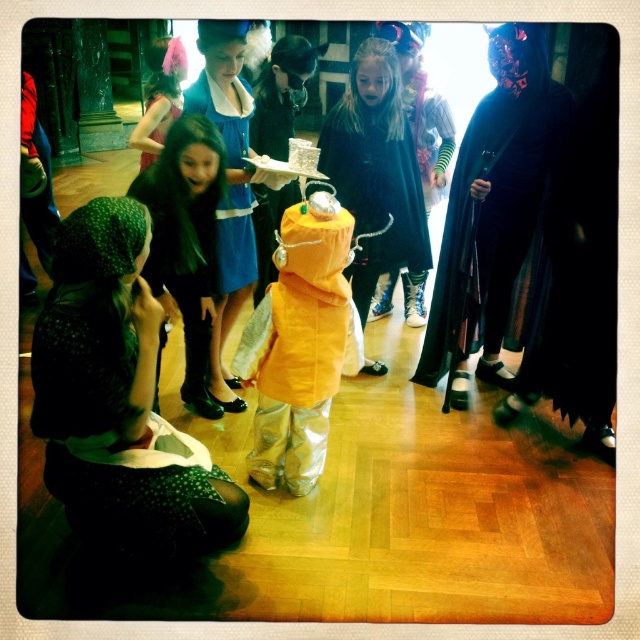
Between orange metallic suit at center and matte pink dress at upper left, which one has less height?

matte pink dress at upper left

What do you see at coordinates (298, 344) in the screenshot? I see `orange metallic suit at center` at bounding box center [298, 344].

Where is `orange metallic suit at center`? orange metallic suit at center is located at coordinates (x=298, y=344).

Is orange metallic suit at center behind matte orange raincoat at center?

No, it is not.

Does orange metallic suit at center appear over matte orange raincoat at center?

No, orange metallic suit at center is not above matte orange raincoat at center.

You are a GUI agent. You are given a task and a screenshot of the screen. Output one action in this format:
    pyautogui.click(x=<x>, y=<y>)
    Task: Click on the orange metallic suit at center
    
    Given the screenshot: What is the action you would take?
    pyautogui.click(x=298, y=344)

You are a GUI agent. You are given a task and a screenshot of the screen. Output one action in this format:
    pyautogui.click(x=<x>, y=<y>)
    Task: Click on the orange metallic suit at center
    
    Given the screenshot: What is the action you would take?
    pyautogui.click(x=298, y=344)

Is matte orange raincoat at center to the right of shiny pink feather at upper left from the viewer's perspective?

Correct, you'll find matte orange raincoat at center to the right of shiny pink feather at upper left.

Does matte orange raincoat at center have a greater height compared to shiny pink feather at upper left?

No, matte orange raincoat at center is not taller than shiny pink feather at upper left.

Measure the distance between matte orange raincoat at center and camera.

matte orange raincoat at center is 7.06 feet from camera.

Where is `matte orange raincoat at center`? The image size is (640, 640). matte orange raincoat at center is located at coordinates (186, 241).